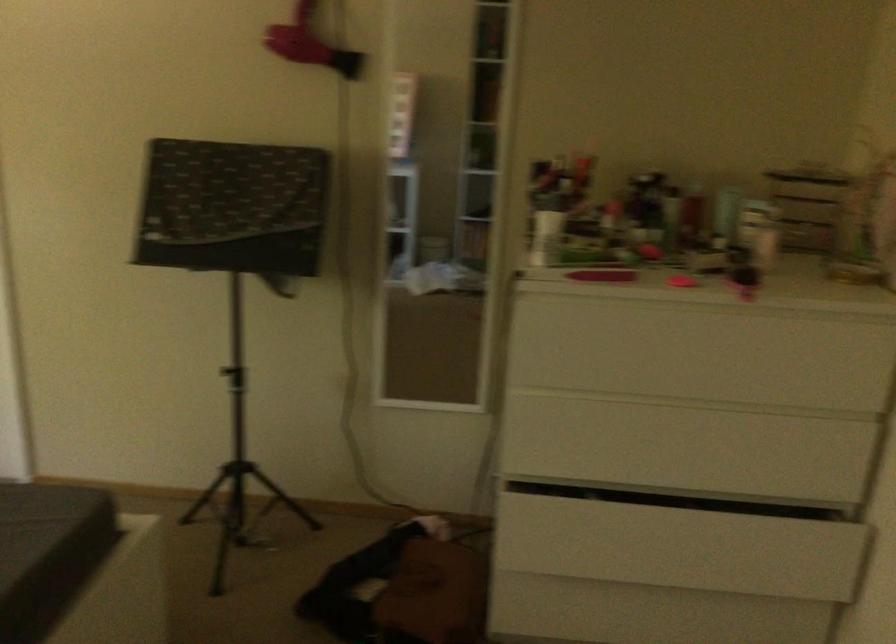
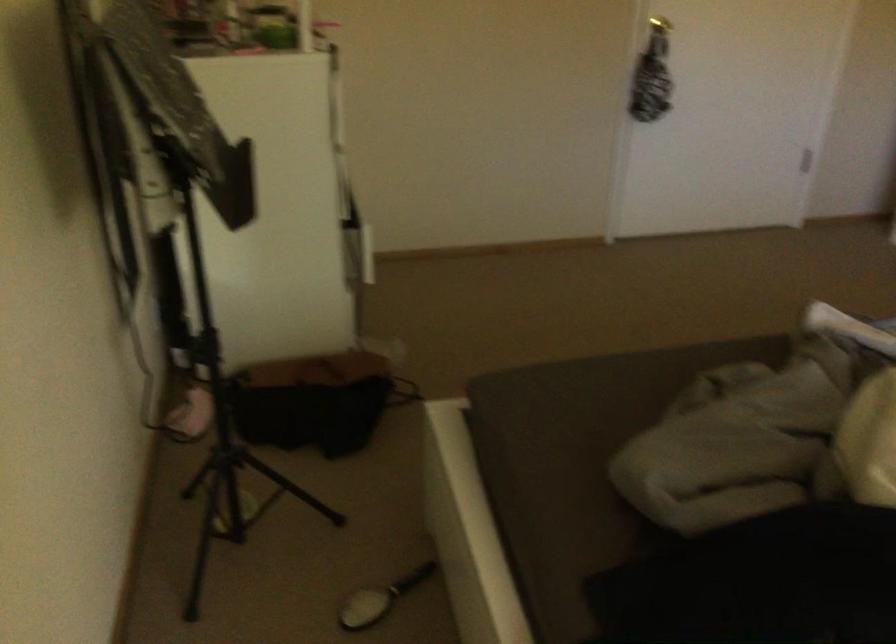
Question: I am providing you with two images of the same scene from different viewpoints. Which of the following objects are not visible in image2?

Choices:
 (A) hanging scarf
 (B) drawer handle
 (C) white label bottle
 (D) gold door knob

Answer: (B)